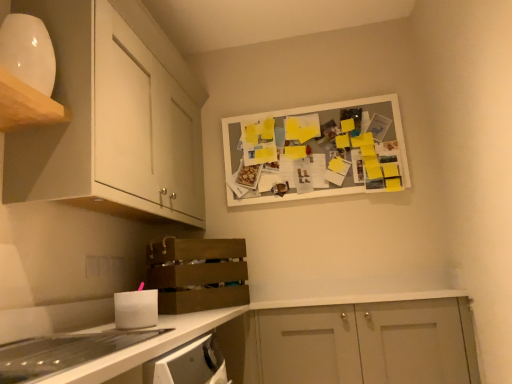
Describe the element at coordinates (319, 150) in the screenshot. This screenshot has width=512, height=384. I see `white matte bulletin board at upper center` at that location.

Locate an element on the screen. white glossy cabinet at upper left, marked as the third cabinetry in a bottom-to-top arrangement is located at coordinates (26, 105).

I want to click on white matte cabinet doors at lower right, placed as the third cabinetry when sorted from top to bottom, so click(365, 343).

Is white matte cabinet doors at lower right, placed as the third cabinetry when sorted from top to bottom, located within brown wooden crate at lower left?

That's incorrect, white matte cabinet doors at lower right, placed as the third cabinetry when sorted from top to bottom, is not inside brown wooden crate at lower left.

Identify the location of cabinetry that appears on the right of brown wooden crate at lower left. (365, 343).

From the image's perspective, is brown wooden crate at lower left above or below white matte cabinet doors at lower right, the third cabinetry from the left?

brown wooden crate at lower left is above white matte cabinet doors at lower right, the third cabinetry from the left.

Does brown wooden crate at lower left come in front of white matte cabinet doors at lower right, arranged as the 1th cabinetry when ordered from the bottom?

Yes, it is.

Does point (331, 354) appear closer or farther from the camera than point (29, 349)?

Clearly, point (331, 354) is more distant from the camera than point (29, 349).

Looking at this image, which object is more forward, white matte cabinet doors at lower right, placed as the first cabinetry when sorted from right to left, or clear plastic drawer at lower left?

Positioned in front is clear plastic drawer at lower left.

Between white matte cabinet doors at lower right, the third cabinetry from the left, and clear plastic drawer at lower left, which one has smaller size?

Smaller between the two is clear plastic drawer at lower left.

Measure the distance between white matte bulletin board at upper center and white matte cabinet at upper left, the second cabinetry in the left-to-right sequence.

white matte bulletin board at upper center is 30.84 inches from white matte cabinet at upper left, the second cabinetry in the left-to-right sequence.

From the image's perspective, count 1st cabinetrys upward from the white matte bulletin board at upper center and point to it. Please provide its 2D coordinates.

[(112, 118)]

Which is more to the left, white matte bulletin board at upper center or white matte cabinet at upper left, positioned as the 2th cabinetry in right-to-left order?

white matte cabinet at upper left, positioned as the 2th cabinetry in right-to-left order.

In terms of height, does white matte bulletin board at upper center look taller or shorter compared to white matte cabinet at upper left, which ranks as the second cabinetry in bottom-to-top order?

white matte bulletin board at upper center is shorter than white matte cabinet at upper left, which ranks as the second cabinetry in bottom-to-top order.

Is white matte cabinet doors at lower right, arranged as the 1th cabinetry when ordered from the bottom, inside white glossy cabinet at upper left, marked as the 3th cabinetry in a right-to-left arrangement?

Definitely not — white matte cabinet doors at lower right, arranged as the 1th cabinetry when ordered from the bottom, is not inside white glossy cabinet at upper left, marked as the 3th cabinetry in a right-to-left arrangement.

Find the location of a particular element. the 2nd cabinetry directly above the white matte cabinet doors at lower right, placed as the third cabinetry when sorted from top to bottom (from a real-world perspective) is located at coordinates (26, 105).

Is white glossy cabinet at upper left, the 1th cabinetry when ordered from left to right, in contact with white matte cabinet doors at lower right, arranged as the 1th cabinetry when ordered from the bottom?

No, white glossy cabinet at upper left, the 1th cabinetry when ordered from left to right, is not with white matte cabinet doors at lower right, arranged as the 1th cabinetry when ordered from the bottom.

Is point (11, 93) behind point (372, 307)?

No.

From a real-world perspective, is white matte bulletin board at upper center positioned under brown wooden crate at lower left based on gravity?

No, from a real-world perspective, white matte bulletin board at upper center is not beneath brown wooden crate at lower left.

Who is bigger, white matte bulletin board at upper center or brown wooden crate at lower left?

With larger size is brown wooden crate at lower left.

Is white matte bulletin board at upper center positioned behind brown wooden crate at lower left?

That is True.

Is white matte bulletin board at upper center located outside brown wooden crate at lower left?

Yes, white matte bulletin board at upper center is not within brown wooden crate at lower left.

Locate an element on the screen. Image resolution: width=512 pixels, height=384 pixels. bulletin board above the white matte cabinet doors at lower right, placed as the first cabinetry when sorted from right to left (from the image's perspective) is located at coordinates (319, 150).

Which of these two, white matte bulletin board at upper center or white matte cabinet doors at lower right, the third cabinetry from the left, stands shorter?

white matte cabinet doors at lower right, the third cabinetry from the left, is shorter.

From a real-world perspective, is white matte bulletin board at upper center located beneath white matte cabinet doors at lower right, placed as the first cabinetry when sorted from right to left?

Incorrect, from a real-world perspective, white matte bulletin board at upper center is higher than white matte cabinet doors at lower right, placed as the first cabinetry when sorted from right to left.

Looking at this image, can you confirm if white matte bulletin board at upper center is positioned to the right of white matte cabinet doors at lower right, the third cabinetry from the left?

Incorrect, white matte bulletin board at upper center is not on the right side of white matte cabinet doors at lower right, the third cabinetry from the left.

Consider the image. Considering the positions of objects white matte cabinet doors at lower right, the third cabinetry from the left, and white matte cabinet at upper left, which appears as the 2th cabinetry when viewed from the top, in the image provided, who is in front, white matte cabinet doors at lower right, the third cabinetry from the left, or white matte cabinet at upper left, which appears as the 2th cabinetry when viewed from the top,?

white matte cabinet at upper left, which appears as the 2th cabinetry when viewed from the top, is in front.

Is there a large distance between white matte cabinet doors at lower right, the third cabinetry from the left, and white matte cabinet at upper left, which ranks as the second cabinetry in bottom-to-top order?

That's right, there is a large distance between white matte cabinet doors at lower right, the third cabinetry from the left, and white matte cabinet at upper left, which ranks as the second cabinetry in bottom-to-top order.

From the image's perspective, which is above, white matte cabinet doors at lower right, placed as the first cabinetry when sorted from right to left, or white matte cabinet at upper left, the second cabinetry in the left-to-right sequence?

From the image's view, white matte cabinet at upper left, the second cabinetry in the left-to-right sequence, is above.

Does white matte cabinet doors at lower right, the third cabinetry from the left, have a greater height compared to white matte cabinet at upper left, the second cabinetry in the left-to-right sequence?

No, white matte cabinet doors at lower right, the third cabinetry from the left, is not taller than white matte cabinet at upper left, the second cabinetry in the left-to-right sequence.

The image size is (512, 384). What are the coordinates of `cabinetry lying behind the brown wooden crate at lower left` in the screenshot? It's located at (365, 343).

Where is `home appliance on the left side of white matte cabinet doors at lower right, placed as the first cabinetry when sorted from right to left`? home appliance on the left side of white matte cabinet doors at lower right, placed as the first cabinetry when sorted from right to left is located at coordinates (63, 352).

Looking at the image, which one is located further to white glossy cabinet at upper left, the 1th cabinetry when ordered from left to right, clear plastic drawer at lower left or brown wooden crate at lower left?

brown wooden crate at lower left is positioned further to the anchor white glossy cabinet at upper left, the 1th cabinetry when ordered from left to right.

When comparing their distances from white matte cabinet doors at lower right, placed as the first cabinetry when sorted from right to left, does white matte bulletin board at upper center or white glossy cabinet at upper left, marked as the 3th cabinetry in a right-to-left arrangement, seem closer?

Based on the image, white matte bulletin board at upper center appears to be nearer to white matte cabinet doors at lower right, placed as the first cabinetry when sorted from right to left.

Estimate the real-world distances between objects in this image. Which object is closer to brown wooden crate at lower left, white matte cabinet doors at lower right, arranged as the 1th cabinetry when ordered from the bottom, or white matte bulletin board at upper center?

The object closer to brown wooden crate at lower left is white matte cabinet doors at lower right, arranged as the 1th cabinetry when ordered from the bottom.

From the image, which object appears to be farther from white glossy cabinet at upper left, marked as the 3th cabinetry in a right-to-left arrangement, white matte bulletin board at upper center or clear plastic drawer at lower left?

white matte bulletin board at upper center.

Considering their positions, is clear plastic drawer at lower left positioned further to white matte cabinet at upper left, the second cabinetry in the left-to-right sequence, than white glossy cabinet at upper left, the 1th cabinetry when ordered from left to right?

The object further to white matte cabinet at upper left, the second cabinetry in the left-to-right sequence, is clear plastic drawer at lower left.

When comparing their distances from white matte bulletin board at upper center, does white matte cabinet doors at lower right, arranged as the 1th cabinetry when ordered from the bottom, or clear plastic drawer at lower left seem closer?

white matte cabinet doors at lower right, arranged as the 1th cabinetry when ordered from the bottom.

Estimate the real-world distances between objects in this image. Which object is further from clear plastic drawer at lower left, white matte cabinet at upper left, which appears as the 2th cabinetry when viewed from the top, or white glossy cabinet at upper left, the 1th cabinetry when ordered from left to right?

Based on the image, white matte cabinet at upper left, which appears as the 2th cabinetry when viewed from the top, appears to be further to clear plastic drawer at lower left.

When comparing their distances from white matte cabinet doors at lower right, the third cabinetry from the left, does white matte cabinet at upper left, which appears as the 2th cabinetry when viewed from the top, or clear plastic drawer at lower left seem closer?

Among the two, white matte cabinet at upper left, which appears as the 2th cabinetry when viewed from the top, is located nearer to white matte cabinet doors at lower right, the third cabinetry from the left.

Locate an element on the screen. shelf between white matte cabinet at upper left, which appears as the 2th cabinetry when viewed from the top, and white matte bulletin board at upper center from front to back is located at coordinates (197, 274).

At what (x,y) coordinates should I click in order to perform the action: click on shelf between white matte cabinet at upper left, the second cabinetry in the left-to-right sequence, and white matte cabinet doors at lower right, the third cabinetry from the left, vertically. Please return your answer as a coordinate pair (x, y). The image size is (512, 384). Looking at the image, I should click on (197, 274).

Where is `shelf between white matte bulletin board at upper center and white matte cabinet doors at lower right, placed as the first cabinetry when sorted from right to left, from top to bottom`? shelf between white matte bulletin board at upper center and white matte cabinet doors at lower right, placed as the first cabinetry when sorted from right to left, from top to bottom is located at coordinates (197, 274).

You are a GUI agent. You are given a task and a screenshot of the screen. Output one action in this format:
    pyautogui.click(x=<x>, y=<y>)
    Task: Click on the shelf between clear plastic drawer at lower left and white matte cabinet doors at lower right, arranged as the 1th cabinetry when ordered from the bottom, from front to back
    
    Given the screenshot: What is the action you would take?
    pyautogui.click(x=197, y=274)